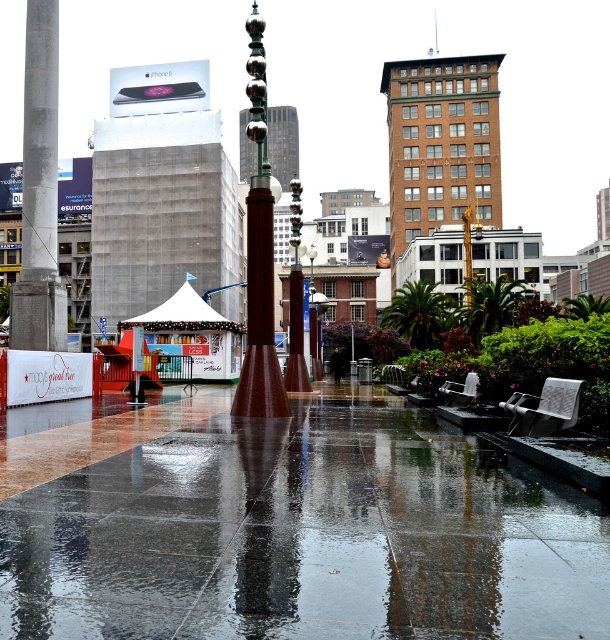
Question: Which point is closer to the camera?

Choices:
 (A) glossy concrete pavement at center
 (B) shiny brown pole at center
 (C) concrete column at left

Answer: (A)

Question: From the image, what is the correct spatial relationship of concrete column at left in relation to metallic pole at center?

Choices:
 (A) below
 (B) above

Answer: (B)

Question: Which point is closer to the camera?

Choices:
 (A) concrete column at left
 (B) metallic pole at center

Answer: (A)

Question: Which object is positioned closest to the glossy concrete pavement at center?

Choices:
 (A) shiny brown pole at center
 (B) metallic pole at center

Answer: (A)

Question: Is concrete column at left bigger than shiny brown pole at center?

Choices:
 (A) yes
 (B) no

Answer: (B)

Question: Can you confirm if brown brick building at upper center is positioned to the right of metallic pole at center?

Choices:
 (A) yes
 (B) no

Answer: (A)